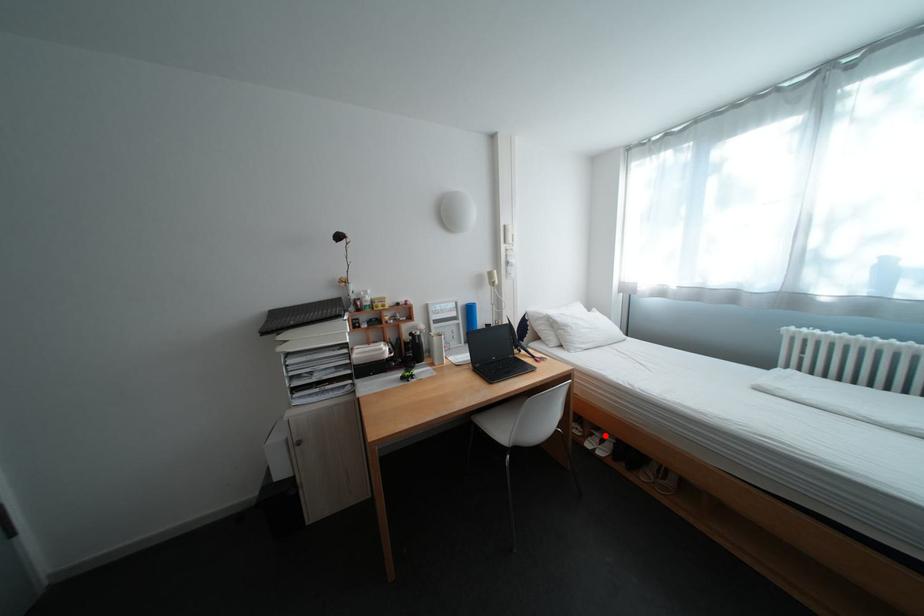
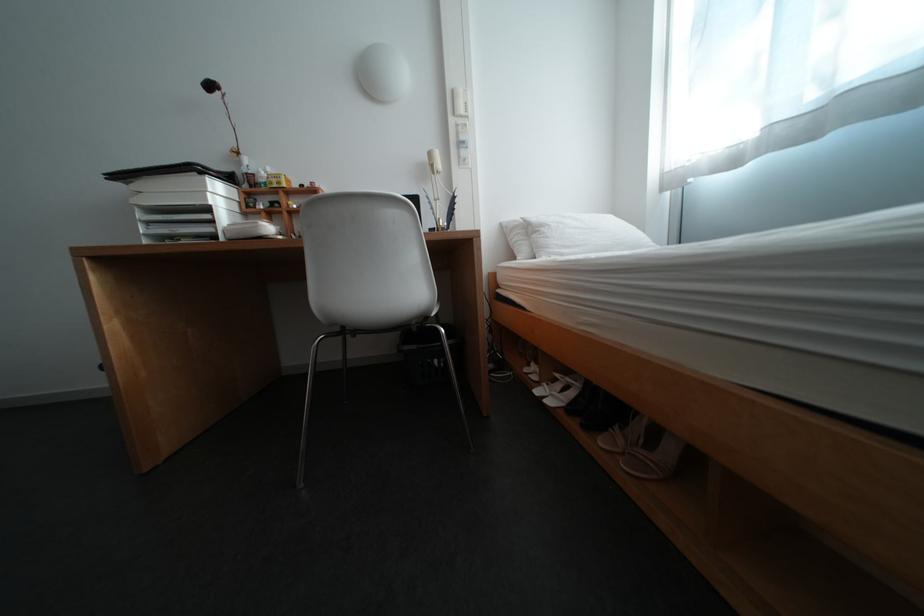
Where in the second image is the point corresponding to the highlighted location from the first image?

(568, 381)